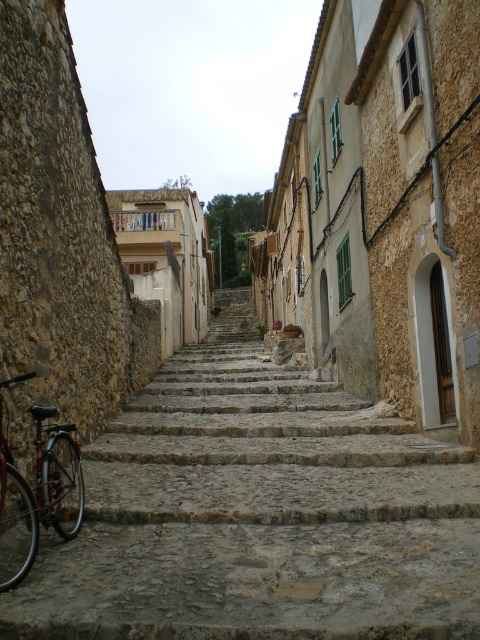
Question: In this image, where is stone steps at center located relative to shiny metallic bicycle at left?

Choices:
 (A) above
 (B) below

Answer: (A)

Question: Which of the following is the closest to the observer?

Choices:
 (A) coord(31,413)
 (B) coord(387,493)

Answer: (B)

Question: Does stone steps at center appear under shiny metallic bicycle at left?

Choices:
 (A) yes
 (B) no

Answer: (B)

Question: Is stone steps at center to the right of shiny metallic bicycle at left from the viewer's perspective?

Choices:
 (A) yes
 (B) no

Answer: (A)

Question: Which point is farther to the camera?

Choices:
 (A) shiny metallic bicycle at left
 (B) stone steps at center

Answer: (A)

Question: Which point appears farthest from the camera in this image?

Choices:
 (A) (47, 502)
 (B) (263, 540)

Answer: (B)